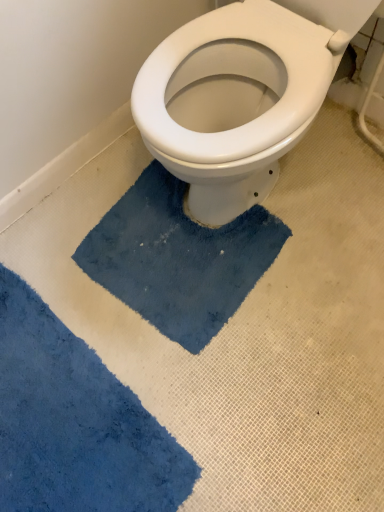
You are a GUI agent. You are given a task and a screenshot of the screen. Output one action in this format:
    pyautogui.click(x=<x>, y=<y>)
    Task: Click on the free region under blue soft rug at lower left, the first bath mat from the bottom (from a real-world perspective)
    The image size is (384, 512).
    Given the screenshot: What is the action you would take?
    pyautogui.click(x=61, y=415)